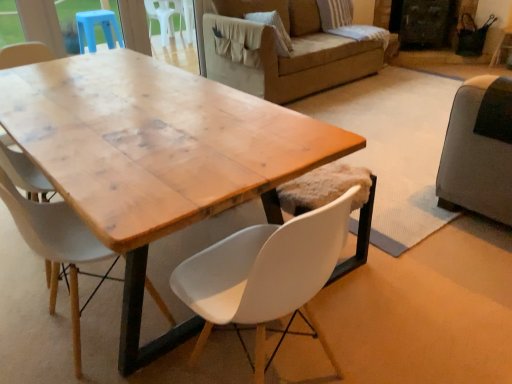
Describe the element at coordinates (154, 157) in the screenshot. This screenshot has width=512, height=384. I see `wooden table at center` at that location.

In order to face white plastic chair at center, which appears as the second chair when viewed from the left, should I rotate leftwards or rightwards?

To face it directly, rotate right by 1.238 degrees.

Find the location of a particular element. dark gray fabric couch at right is located at coordinates (479, 150).

Consider the image. Can we say black matte screen door at upper right lies outside white plastic chair at center, which appears as the second chair when viewed from the left?

Yes, black matte screen door at upper right is located beyond the bounds of white plastic chair at center, which appears as the second chair when viewed from the left.

Can you confirm if black matte screen door at upper right is positioned to the right of white plastic chair at center, which is the first chair from right to left?

Yes, black matte screen door at upper right is to the right of white plastic chair at center, which is the first chair from right to left.

Is there a large distance between black matte screen door at upper right and white plastic chair at center, which is the first chair from right to left?

Yes, black matte screen door at upper right is far from white plastic chair at center, which is the first chair from right to left.

From the image's perspective, is black matte screen door at upper right above white plastic chair at center, which appears as the second chair when viewed from the left?

Yes, from the image's perspective, black matte screen door at upper right is over white plastic chair at center, which appears as the second chair when viewed from the left.

Looking at this image, from the image's perspective, does striped fabric pillow at upper right appear higher than white matte chair at center, the 2th chair viewed from the right?

Yes.

Which point is more forward, (x=282, y=40) or (x=52, y=260)?

The point (x=52, y=260) is closer to the camera.

Is striped fabric pillow at upper right touching white matte chair at center, the first chair when ordered from left to right?

There is a gap between striped fabric pillow at upper right and white matte chair at center, the first chair when ordered from left to right.

In the scene shown: How many degrees apart are the facing directions of striped fabric pillow at upper right and white matte chair at center, the first chair when ordered from left to right?

The angular difference between striped fabric pillow at upper right and white matte chair at center, the first chair when ordered from left to right, is 89.5 degrees.

Is black matte screen door at upper right at the back of white matte chair at center, the 2th chair viewed from the right?

No, white matte chair at center, the 2th chair viewed from the right,'s orientation is not away from black matte screen door at upper right.

Is white matte chair at center, the 2th chair viewed from the right, spatially inside black matte screen door at upper right, or outside of it?

white matte chair at center, the 2th chair viewed from the right, is not enclosed by black matte screen door at upper right.

From a real-world perspective, which is physically below, white matte chair at center, the 2th chair viewed from the right, or black matte screen door at upper right?

black matte screen door at upper right, from a real-world perspective.

Can you confirm if black matte screen door at upper right is wider than striped fabric pillow at upper right?

Correct, the width of black matte screen door at upper right exceeds that of striped fabric pillow at upper right.

From the picture: Considering the positions of objects black matte screen door at upper right and striped fabric pillow at upper right in the image provided, who is behind, black matte screen door at upper right or striped fabric pillow at upper right?

black matte screen door at upper right is behind.

Looking at this image, is black matte screen door at upper right smaller than striped fabric pillow at upper right?

No, black matte screen door at upper right is not smaller than striped fabric pillow at upper right.

Are black matte screen door at upper right and striped fabric pillow at upper right located far from each other?

Absolutely, black matte screen door at upper right is distant from striped fabric pillow at upper right.

Considering the positions of point (279, 39) and point (463, 86), is point (279, 39) closer or farther from the camera than point (463, 86)?

Point (279, 39) is positioned farther from the camera compared to point (463, 86).

Is striped fabric pillow at upper right looking in the opposite direction of dark gray fabric couch at right?

No, striped fabric pillow at upper right is not facing away from dark gray fabric couch at right.

This screenshot has height=384, width=512. What are the coordinates of `studio couch in front of the striped fabric pillow at upper right` in the screenshot? It's located at (479, 150).

Considering the relative positions of striped fabric pillow at upper right and dark gray fabric couch at right in the image provided, is striped fabric pillow at upper right to the right of dark gray fabric couch at right from the viewer's perspective?

No, striped fabric pillow at upper right is not to the right of dark gray fabric couch at right.

Is white matte chair at center, the 2th chair viewed from the right, turned away from white plastic chair at center, which is the first chair from right to left?

No, white matte chair at center, the 2th chair viewed from the right, is not facing away from white plastic chair at center, which is the first chair from right to left.

Would you consider white matte chair at center, the 2th chair viewed from the right, to be distant from white plastic chair at center, which appears as the second chair when viewed from the left?

That's not correct — white matte chair at center, the 2th chair viewed from the right, is a little close to white plastic chair at center, which appears as the second chair when viewed from the left.

From a real-world perspective, which is physically below, wooden table at center or striped fabric pillow at upper right?

wooden table at center, from a real-world perspective.

Between wooden table at center and striped fabric pillow at upper right, which one has smaller width?

Thinner between the two is striped fabric pillow at upper right.

I want to click on coffee table located underneath the striped fabric pillow at upper right (from a real-world perspective), so click(154, 157).

From the picture: Does wooden table at center contain striped fabric pillow at upper right?

No.

From a real-world perspective, count 2nd chairs upward from the black matte screen door at upper right and point to it. Please provide its 2D coordinates.

[(265, 275)]

At what (x,y) coordinates should I click in order to perform the action: click on the 2nd chair to the left of the striped fabric pillow at upper right, starting your count from the anchor. Please return your answer as a coordinate pair (x, y). Looking at the image, I should click on (56, 246).

From the image, which object appears to be farther from dark gray fabric couch at right, white matte chair at center, the 2th chair viewed from the right, or striped fabric pillow at upper right?

striped fabric pillow at upper right is positioned further to the anchor dark gray fabric couch at right.

Which object lies further to the anchor point black matte screen door at upper right, white plastic chair at center, which is the first chair from right to left, or striped fabric pillow at upper right?

white plastic chair at center, which is the first chair from right to left.

Estimate the real-world distances between objects in this image. Which object is further from black matte screen door at upper right, dark gray fabric couch at right or striped fabric pillow at upper right?

Among the two, dark gray fabric couch at right is located further to black matte screen door at upper right.

Considering their positions, is dark gray fabric couch at right positioned closer to black matte screen door at upper right than wooden table at center?

dark gray fabric couch at right lies closer to black matte screen door at upper right than the other object.

Which object lies further to the anchor point striped fabric pillow at upper right, white matte chair at center, the 2th chair viewed from the right, or wooden table at center?

white matte chair at center, the 2th chair viewed from the right.

Looking at the image, which one is located closer to wooden table at center, black matte screen door at upper right or dark gray fabric couch at right?

Based on the image, dark gray fabric couch at right appears to be nearer to wooden table at center.

Which object lies further to the anchor point dark gray fabric couch at right, white matte chair at center, the 2th chair viewed from the right, or wooden table at center?

Among the two, white matte chair at center, the 2th chair viewed from the right, is located further to dark gray fabric couch at right.

Based on their spatial positions, is white matte chair at center, the first chair when ordered from left to right, or dark gray fabric couch at right closer to black matte screen door at upper right?

The object closer to black matte screen door at upper right is dark gray fabric couch at right.

Find the location of a particular element. The image size is (512, 384). chair between wooden table at center and black matte screen door at upper right in the front-back direction is located at coordinates (56, 246).

The height and width of the screenshot is (384, 512). Identify the location of chair located between wooden table at center and striped fabric pillow at upper right in the depth direction. (56, 246).

In order to click on chair between white matte chair at center, the 2th chair viewed from the right, and dark gray fabric couch at right from left to right in this screenshot , I will do `click(265, 275)`.

Locate an element on the screen. chair between white plastic chair at center, which appears as the second chair when viewed from the left, and black matte screen door at upper right in the front-back direction is located at coordinates (56, 246).